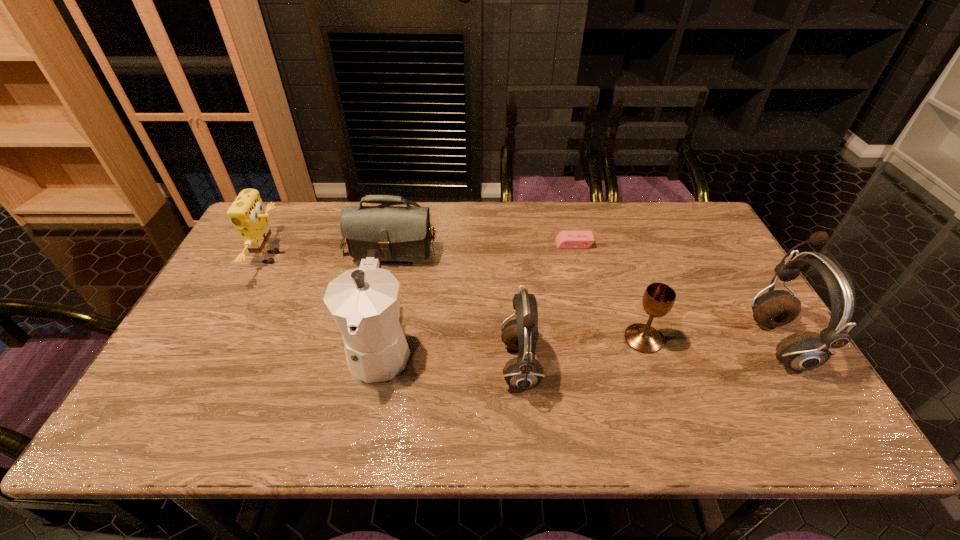
Where is `coffeepot`? The image size is (960, 540). coffeepot is located at coordinates (364, 302).

The height and width of the screenshot is (540, 960). Identify the location of free region located 0.330m on the ear pads of the left earphone. [x=676, y=367].

Identify the location of free spot located 0.200m on the ear pads of the right earphone. The width and height of the screenshot is (960, 540). (677, 341).

Find the location of a particular element. This screenshot has width=960, height=540. vacant space located 0.170m on the ear pads of the right earphone is located at coordinates (688, 341).

Image resolution: width=960 pixels, height=540 pixels. I want to click on free region located 0.270m on the ear pads of the right earphone, so click(649, 341).

This screenshot has height=540, width=960. Identify the location of blank space located 0.120m on the right of the shoulder bag. (477, 235).

What are the coordinates of `vacant region located 0.390m on the left of the sixth object from left to right` in the screenshot? It's located at (473, 339).

Locate an element on the screen. The height and width of the screenshot is (540, 960). free space located on the face of the leftmost object is located at coordinates (315, 258).

This screenshot has height=540, width=960. Identify the location of blank space located 0.140m on the front of the fifth object from left to right. (583, 280).

At what (x,y) coordinates should I click in order to perform the action: click on shoulder bag that is at the far edge. Please return your answer as a coordinate pair (x, y). Looking at the image, I should click on (399, 233).